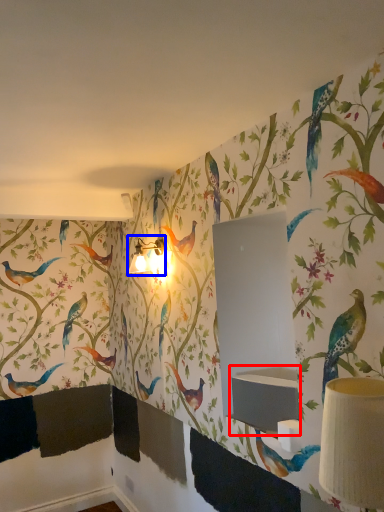
Question: Among these objects, which one is farthest to the camera, sink (highlighted by a red box) or table lamp (highlighted by a blue box)?

Choices:
 (A) sink
 (B) table lamp

Answer: (B)